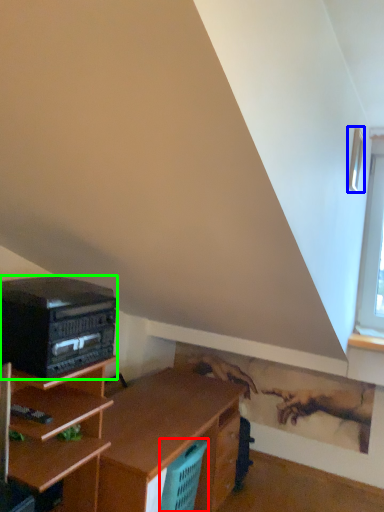
Question: Which object is the closest to the basket (highlighted by a red box)? Choose among these: window (highlighted by a blue box) or stereo (highlighted by a green box).

Choices:
 (A) window
 (B) stereo

Answer: (B)